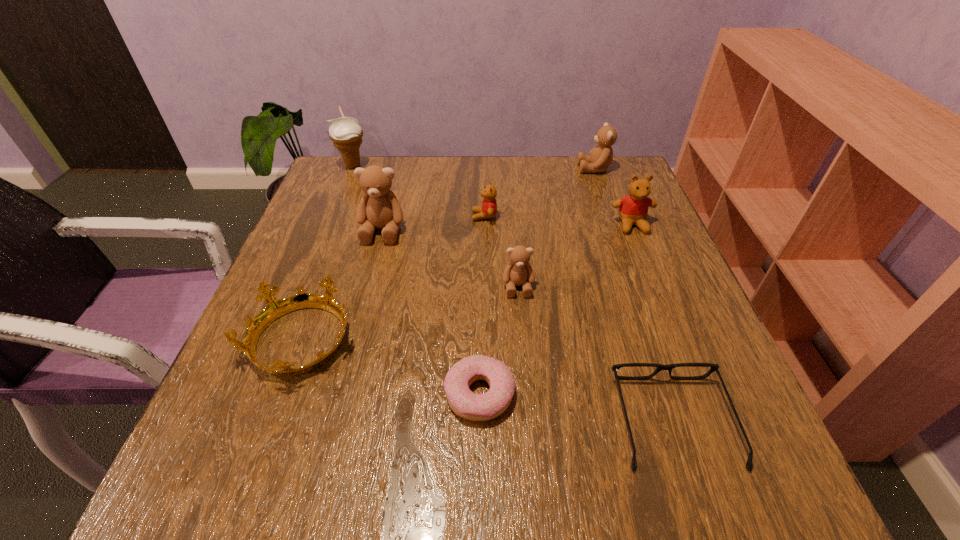
This screenshot has width=960, height=540. What are the coordinates of `the third shortest object` in the screenshot? It's located at (275, 308).

Find the location of a particular element. The width and height of the screenshot is (960, 540). crown is located at coordinates (275, 308).

At what (x,y) coordinates should I click in order to perform the action: click on spectacles. Please return your answer as a coordinate pair (x, y). The width and height of the screenshot is (960, 540). Looking at the image, I should click on [714, 367].

Where is `doughnut`? doughnut is located at coordinates (475, 407).

Where is `free spot located on the right of the white icecream`? free spot located on the right of the white icecream is located at coordinates (442, 165).

Locate an element on the screen. The width and height of the screenshot is (960, 540). free location located 0.340m on the front-facing side of the leftmost brown teddy bear is located at coordinates (344, 381).

Where is `vacant region located on the front-facing side of the second smallest brown teddy bear`? The width and height of the screenshot is (960, 540). vacant region located on the front-facing side of the second smallest brown teddy bear is located at coordinates (538, 168).

Locate an element on the screen. This screenshot has width=960, height=540. vacant space located on the front-facing side of the second smallest brown teddy bear is located at coordinates (530, 168).

In order to click on vacant area situated on the front-facing side of the second smallest brown teddy bear in this screenshot , I will do `click(544, 168)`.

Where is `vacant space located on the front-facing side of the right red teddy bear`? vacant space located on the front-facing side of the right red teddy bear is located at coordinates (650, 269).